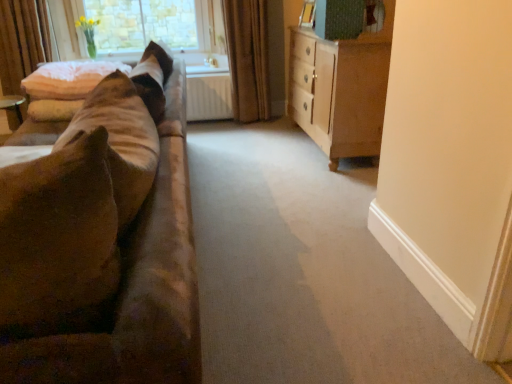
The image size is (512, 384). I want to click on free space in front of light brown wood dresser at right, so click(303, 188).